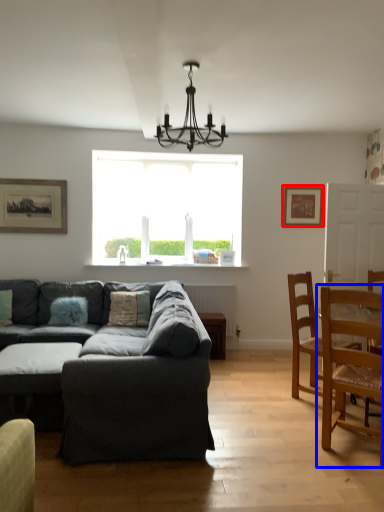
Question: Which object appears farthest to the camera in this image, picture frame (highlighted by a red box) or chair (highlighted by a blue box)?

Choices:
 (A) picture frame
 (B) chair

Answer: (A)